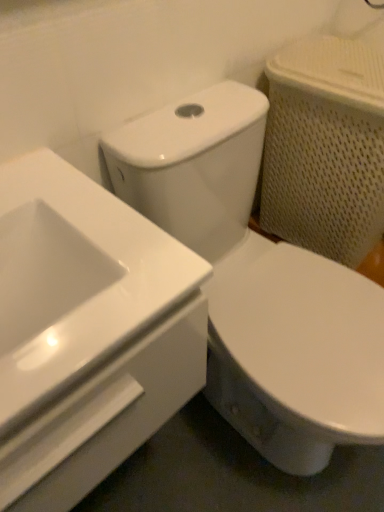
Question: Should I look upward or downward to see white glossy sink at upper left?

Choices:
 (A) down
 (B) up

Answer: (A)

Question: Is white glossy sink at upper left not inside white glossy toilet at center?

Choices:
 (A) yes
 (B) no

Answer: (A)

Question: Is white glossy sink at upper left thinner than white glossy toilet at center?

Choices:
 (A) yes
 (B) no

Answer: (A)

Question: Considering the relative sizes of white glossy sink at upper left and white glossy toilet at center in the image provided, is white glossy sink at upper left wider than white glossy toilet at center?

Choices:
 (A) no
 (B) yes

Answer: (A)

Question: From the image's perspective, is white glossy sink at upper left below white glossy toilet at center?

Choices:
 (A) yes
 (B) no

Answer: (B)

Question: From a real-world perspective, is white glossy sink at upper left positioned over white glossy toilet at center based on gravity?

Choices:
 (A) yes
 (B) no

Answer: (A)

Question: Is white glossy toilet at center inside white glossy sink at upper left?

Choices:
 (A) yes
 (B) no

Answer: (B)

Question: From a real-world perspective, is white glossy toilet at center positioned under white glossy sink at upper left based on gravity?

Choices:
 (A) yes
 (B) no

Answer: (A)

Question: Does white glossy toilet at center have a lesser height compared to white glossy sink at upper left?

Choices:
 (A) yes
 (B) no

Answer: (B)

Question: Does white glossy toilet at center appear on the left side of white glossy sink at upper left?

Choices:
 (A) no
 (B) yes

Answer: (A)

Question: Is white glossy sink at upper left surrounded by white glossy toilet at center?

Choices:
 (A) yes
 (B) no

Answer: (B)

Question: Is white glossy toilet at center not within white glossy sink at upper left?

Choices:
 (A) yes
 (B) no

Answer: (A)

Question: From the image's perspective, would you say white glossy toilet at center is positioned over white glossy sink at upper left?

Choices:
 (A) no
 (B) yes

Answer: (A)

Question: Is white glossy toilet at center to the left or to the right of white glossy sink at upper left in the image?

Choices:
 (A) right
 (B) left

Answer: (A)